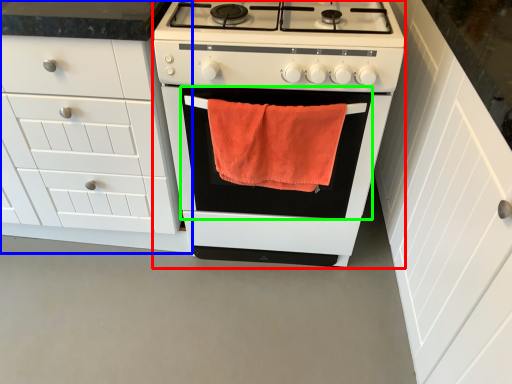
Question: Which is nearer to the appliance (highlighted by a red box)? cabinetry (highlighted by a blue box) or oven (highlighted by a green box).

Choices:
 (A) cabinetry
 (B) oven

Answer: (B)